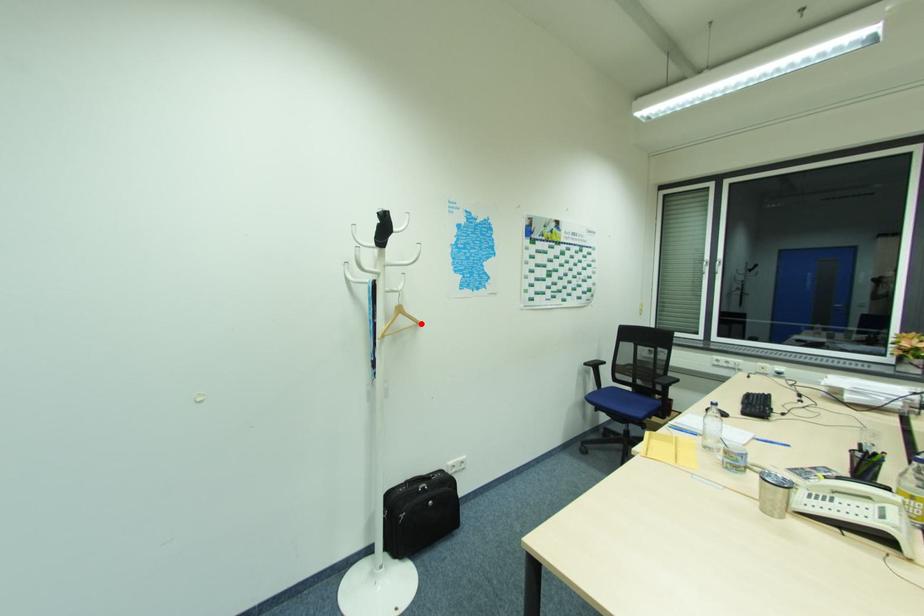
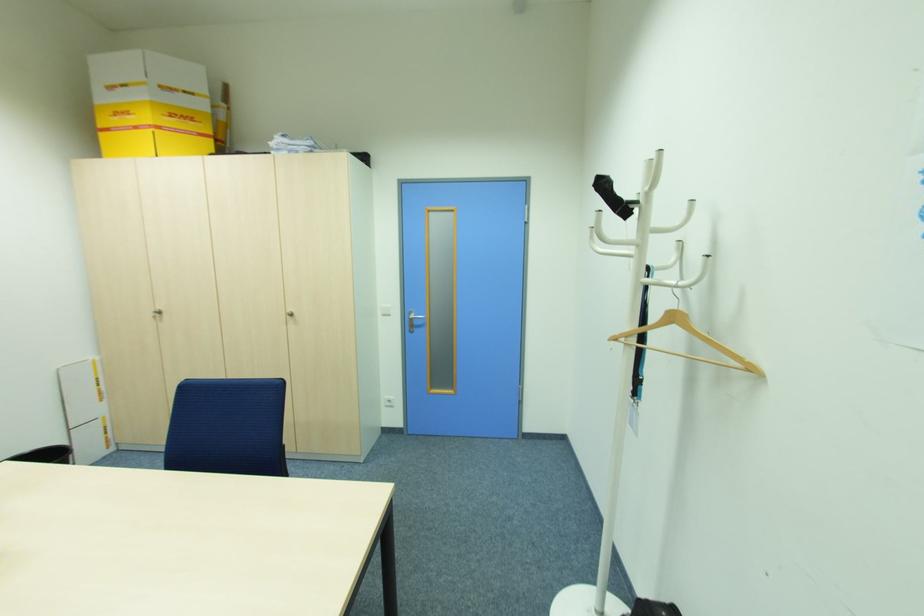
In the second image, find the point that corresponds to the highlighted location in the first image.

(756, 370)